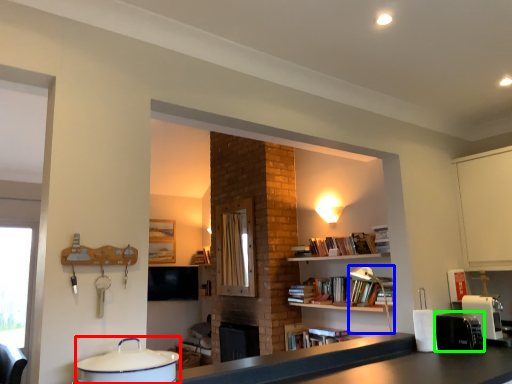
Question: Which object is positioned closest to appliance (highlighted by a red box)? Select from lamp (highlighted by a blue box) and appliance (highlighted by a green box).

Choices:
 (A) lamp
 (B) appliance

Answer: (B)